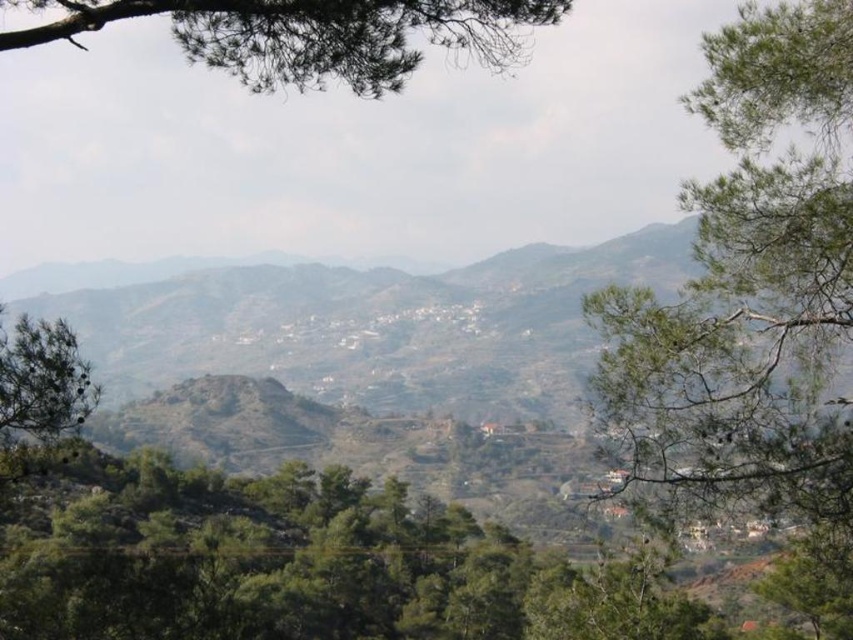
Identify the location of green leafy tree at right. The width and height of the screenshot is (853, 640). (751, 291).

Which is in front, point (610, 416) or point (90, 396)?

Point (90, 396) is more forward.

Where is `green leafy tree at right`? green leafy tree at right is located at coordinates (751, 291).

Who is positioned more to the left, green leafy tree at right or brown rocky mountain at center?

Positioned to the left is brown rocky mountain at center.

Is point (786, 333) farther from viewer compared to point (538, 365)?

No, it is in front of (538, 365).

Where is `green leafy tree at right`? The width and height of the screenshot is (853, 640). green leafy tree at right is located at coordinates (751, 291).

Between green leafy tree at center and green needle-like leaves at upper center, which one is positioned higher?

green needle-like leaves at upper center is above.

Which is more to the left, green leafy tree at center or green needle-like leaves at upper center?

green needle-like leaves at upper center

Does point (285, 467) lie in front of point (35, 6)?

No, (285, 467) is behind (35, 6).

You are a GUI agent. You are given a task and a screenshot of the screen. Output one action in this format:
    pyautogui.click(x=<x>, y=<y>)
    Task: Click on the green leafy tree at center
    This screenshot has width=853, height=640.
    Given the screenshot: What is the action you would take?
    289,563